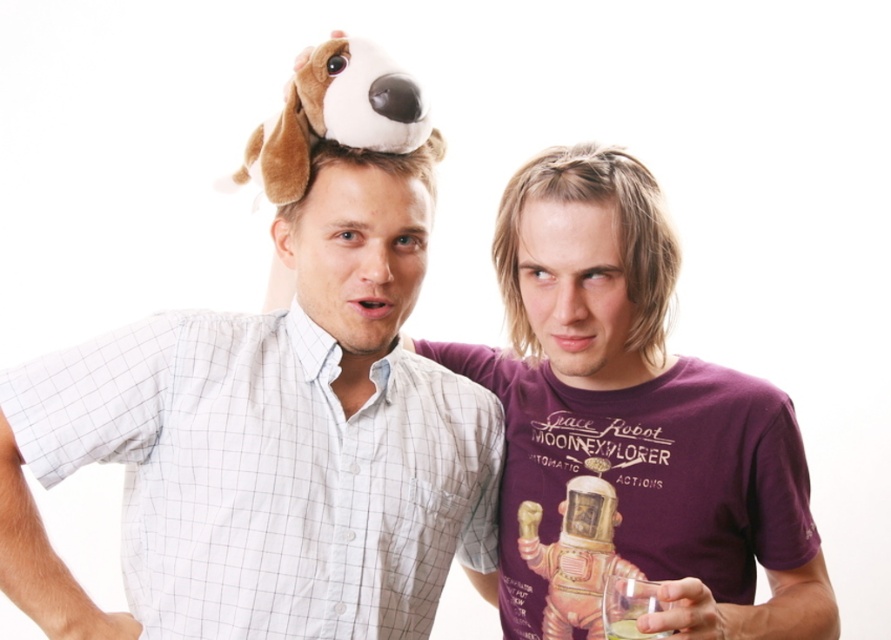
Based on the photo, you are a photographer trying to capture a clear photo of the translucent glass at lower right. The brown plush dog at center is blocking the view. Can you move the dog to the side to get a better shot?

The brown plush dog at center is larger than the translucent glass at lower right, so moving it might be necessary to avoid blocking the view.